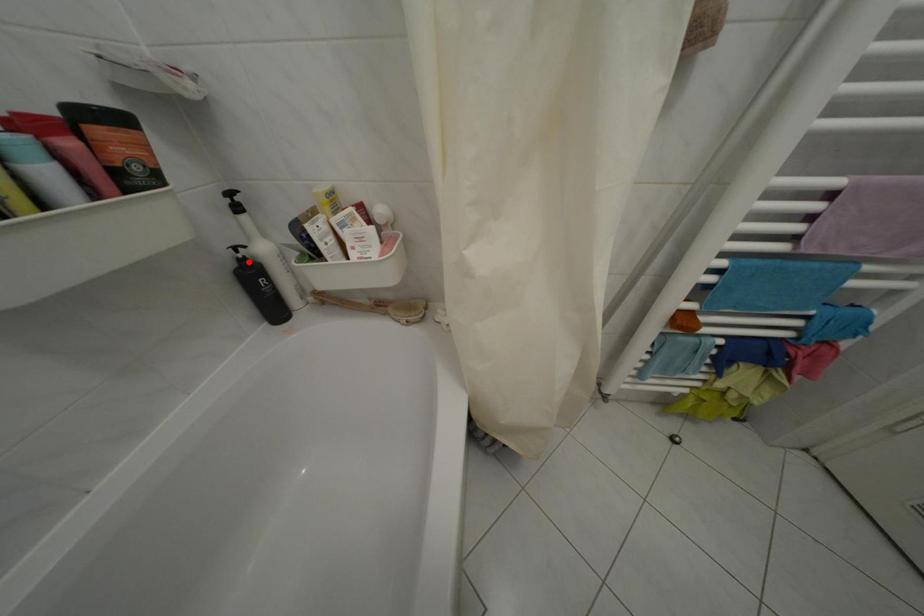
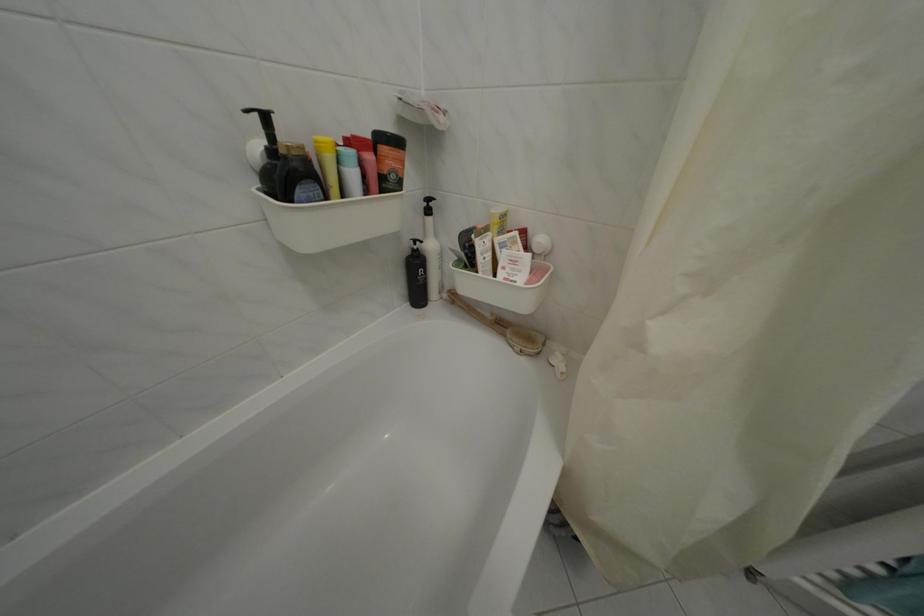
Find the pixel in the second image that matches the highlighted location in the first image.

(424, 254)